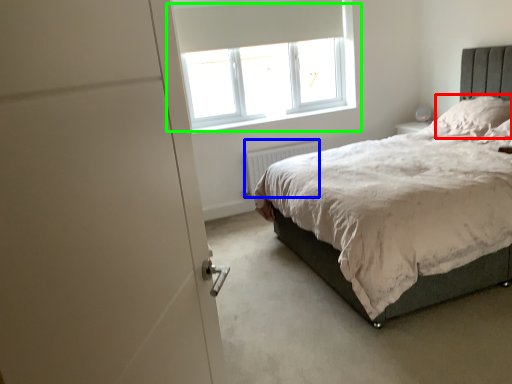
Question: Which is nearer to the pillow (highlighted by a red box)? radiator (highlighted by a blue box) or window (highlighted by a green box).

Choices:
 (A) radiator
 (B) window

Answer: (A)